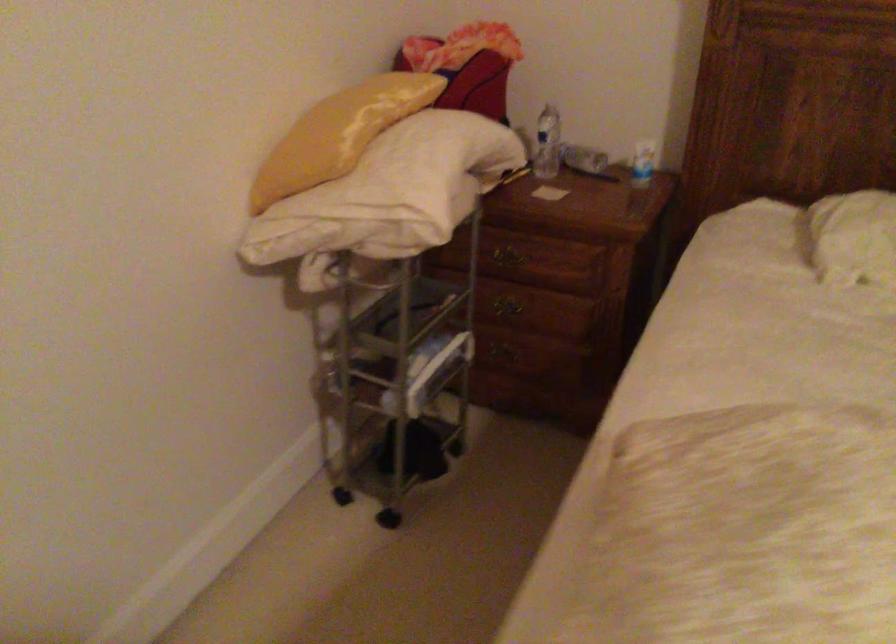
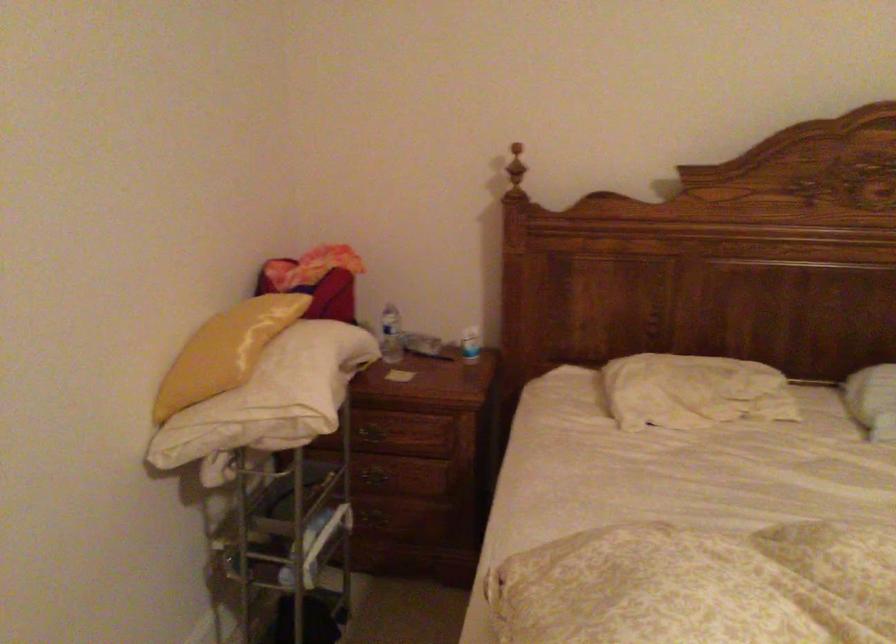
The point at (325,133) is marked in the first image. Where is the corresponding point in the second image?

(225, 351)